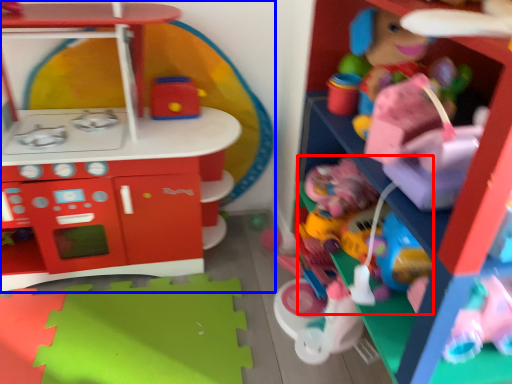
Question: Which of the following is the closest to the observer, toy (highlighted by a red box) or toy (highlighted by a blue box)?

Choices:
 (A) toy
 (B) toy

Answer: (B)